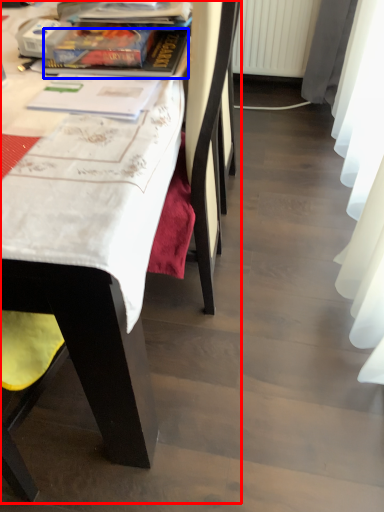
Question: Which object is further to the camera taking this photo, chair (highlighted by a red box) or book (highlighted by a blue box)?

Choices:
 (A) chair
 (B) book

Answer: (B)